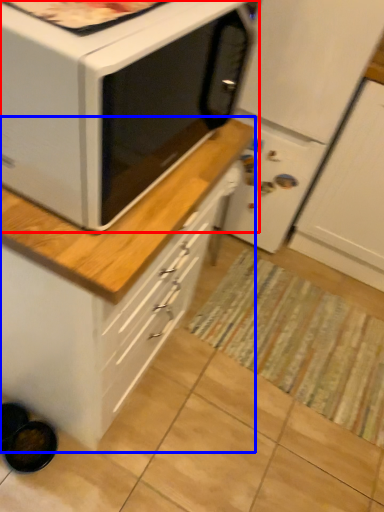
Question: Among these objects, which one is nearest to the camera, microwave oven (highlighted by a red box) or cabinetry (highlighted by a blue box)?

Choices:
 (A) microwave oven
 (B) cabinetry

Answer: (A)